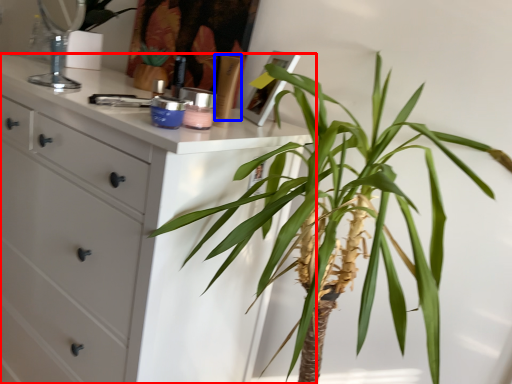
Question: Which object appears closest to the camera in this image, chest of drawers (highlighted by a red box) or toiletry (highlighted by a blue box)?

Choices:
 (A) chest of drawers
 (B) toiletry

Answer: (A)